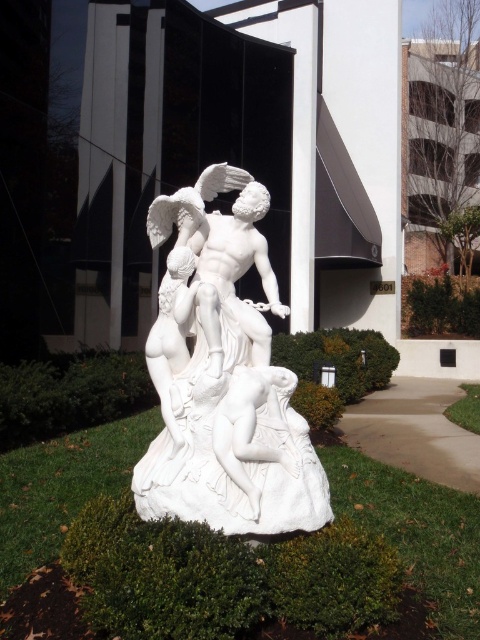
Question: Can you confirm if white marble sculpture at center is positioned to the left of white marble nude at lower center?

Choices:
 (A) yes
 (B) no

Answer: (A)

Question: Is white marble sculpture at center positioned in front of white marble nude at lower center?

Choices:
 (A) no
 (B) yes

Answer: (A)

Question: Which point is closer to the camera?

Choices:
 (A) (217, 452)
 (B) (219, 371)

Answer: (A)

Question: Which of the following is the farthest from the observer?

Choices:
 (A) white marble nude at lower center
 (B) white marble sculpture at center

Answer: (B)

Question: Considering the relative positions of white marble sculpture at center and white marble nude at lower center in the image provided, where is white marble sculpture at center located with respect to white marble nude at lower center?

Choices:
 (A) above
 (B) below

Answer: (A)